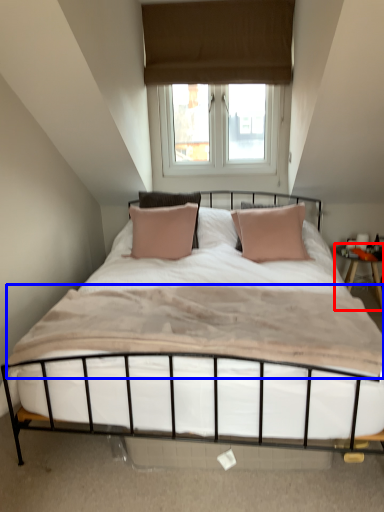
Question: Which point is closer to the camera, nightstand (highlighted by a red box) or mattress (highlighted by a blue box)?

Choices:
 (A) nightstand
 (B) mattress

Answer: (B)